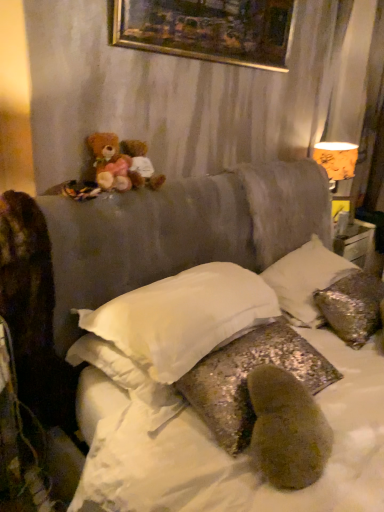
Question: Does silver sequined pillow at upper right, acting as the 1th pillow starting from the right, have a greater width compared to orange paper lampshade at upper right?

Choices:
 (A) no
 (B) yes

Answer: (B)

Question: Does silver sequined pillow at upper right, acting as the 1th pillow starting from the right, have a smaller size compared to orange paper lampshade at upper right?

Choices:
 (A) no
 (B) yes

Answer: (A)

Question: Is silver sequined pillow at upper right, which is the 3th pillow from left to right, thinner than orange paper lampshade at upper right?

Choices:
 (A) yes
 (B) no

Answer: (B)

Question: Could you tell me if silver sequined pillow at upper right, which is the 3th pillow from left to right, is facing orange paper lampshade at upper right?

Choices:
 (A) no
 (B) yes

Answer: (A)

Question: Is silver sequined pillow at upper right, which is the 3th pillow from left to right, located outside orange paper lampshade at upper right?

Choices:
 (A) no
 (B) yes

Answer: (B)

Question: Looking at the image, does orange paper lampshade at upper right seem bigger or smaller compared to soft brown teddy bear at upper left, the first teddy bear in the left-to-right sequence?

Choices:
 (A) big
 (B) small

Answer: (A)

Question: In the image, is orange paper lampshade at upper right positioned in front of or behind soft brown teddy bear at upper left, which appears as the second teddy bear when viewed from the right?

Choices:
 (A) behind
 (B) front

Answer: (A)

Question: Is point (340, 145) closer or farther from the camera than point (112, 141)?

Choices:
 (A) closer
 (B) farther

Answer: (B)

Question: Based on their positions, is orange paper lampshade at upper right located to the left or right of soft brown teddy bear at upper left, the first teddy bear in the left-to-right sequence?

Choices:
 (A) right
 (B) left

Answer: (A)

Question: Based on their positions, is soft brown teddy bear at upper left, which appears as the second teddy bear when viewed from the right, located to the left or right of silver sequined pillow at upper right, which is the 3th pillow from left to right?

Choices:
 (A) right
 (B) left

Answer: (B)

Question: From their relative heights in the image, would you say soft brown teddy bear at upper left, the first teddy bear in the left-to-right sequence, is taller or shorter than silver sequined pillow at upper right, which is the 3th pillow from left to right?

Choices:
 (A) tall
 (B) short

Answer: (B)

Question: Does point (134, 173) appear closer or farther from the camera than point (306, 315)?

Choices:
 (A) farther
 (B) closer

Answer: (B)

Question: From a real-world perspective, is soft brown teddy bear at upper left, which appears as the second teddy bear when viewed from the right, physically located above or below silver sequined pillow at upper right, acting as the 1th pillow starting from the right?

Choices:
 (A) below
 (B) above

Answer: (B)

Question: From their relative heights in the image, would you say fluffy brown teddy bear at upper left, arranged as the 1th teddy bear when viewed from the right, is taller or shorter than gold-framed painting at upper center?

Choices:
 (A) tall
 (B) short

Answer: (B)

Question: From the image's perspective, relative to gold-framed painting at upper center, is fluffy brown teddy bear at upper left, which appears as the second teddy bear when viewed from the left, above or below?

Choices:
 (A) above
 (B) below

Answer: (B)